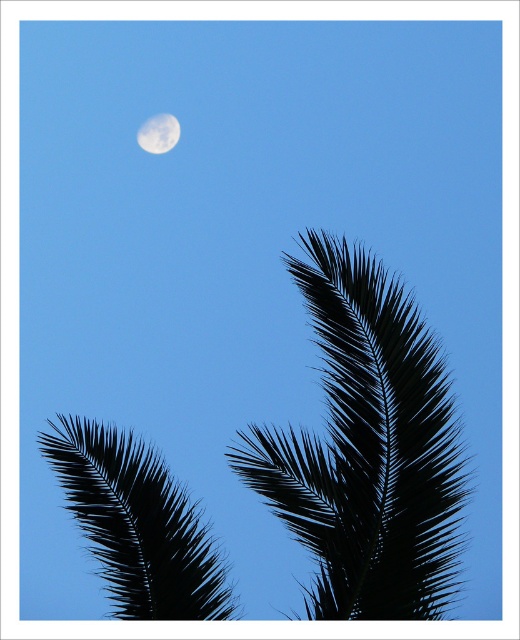
You are standing in the scene and want to pick up the black matte palm leaf at lower left. Is the black spiky palm at center blocking your path to it?

The black spiky palm at center is in front of the black matte palm leaf at lower left, so it is blocking your path to the leaf.